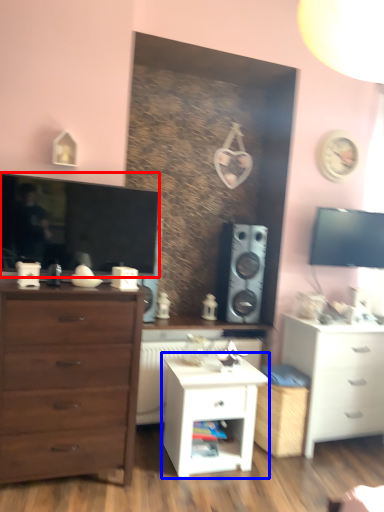
Question: Which object appears farthest to the camera in this image, television (highlighted by a red box) or nightstand (highlighted by a blue box)?

Choices:
 (A) television
 (B) nightstand

Answer: (B)